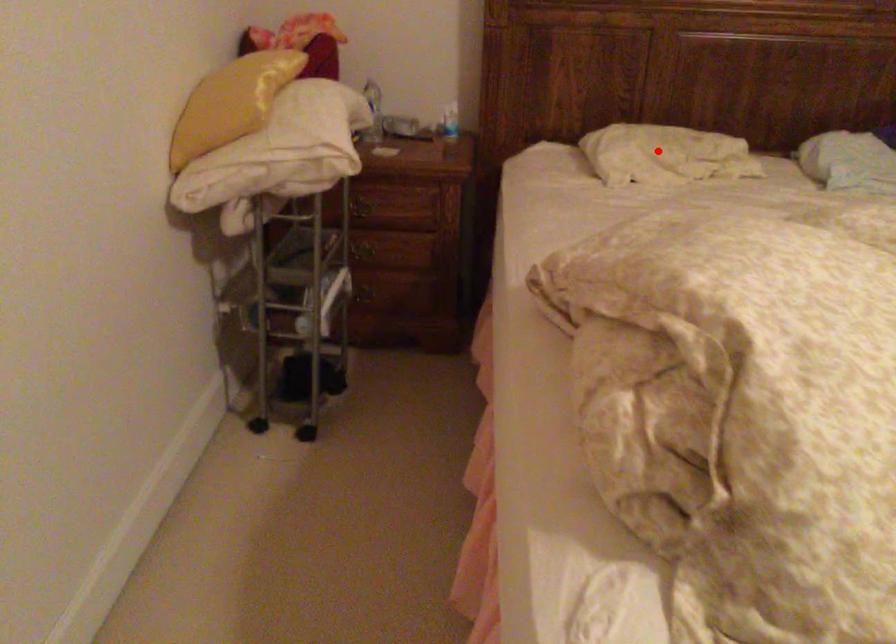
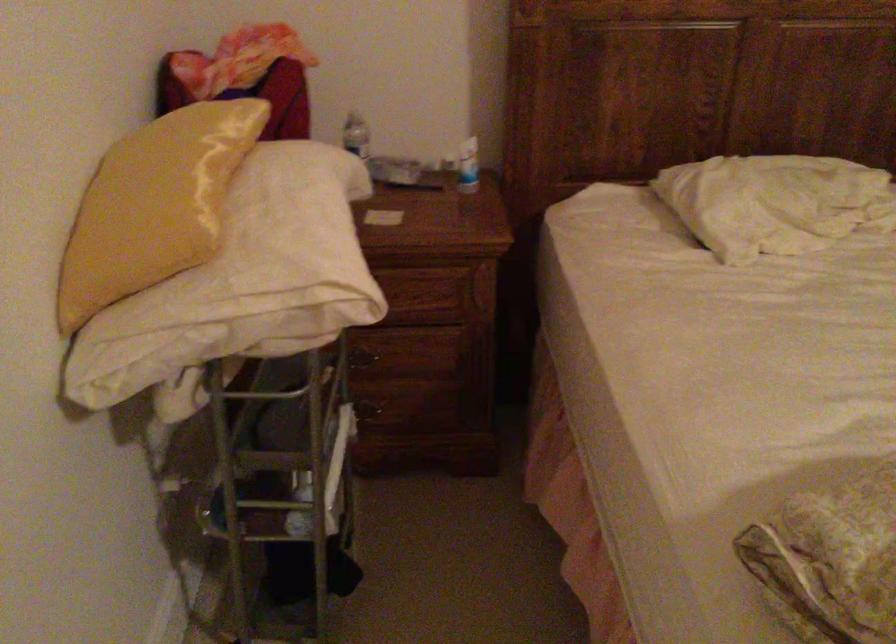
Question: I am providing you with two images of the same scene from different viewpoints. Image1 has a red point marked. In image2, the corresponding 3D location appears at what relative position? Reply with the corresponding letter.

Choices:
 (A) Closer
 (B) Farther

Answer: (A)